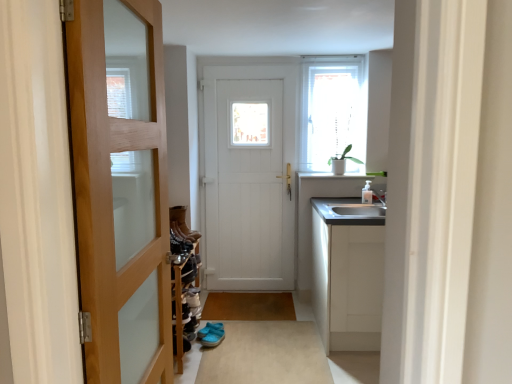
The image size is (512, 384). I want to click on free spot below beige carpet at center, the first plain from the bottom (from a real-world perspective), so click(257, 352).